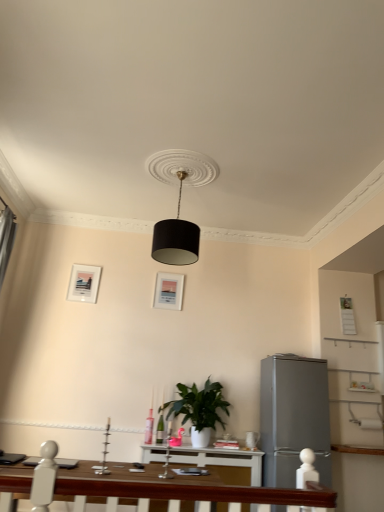
Question: Is black matte lampshade at center smaller than matte white picture frame at upper left, arranged as the first picture frame when viewed from the left?

Choices:
 (A) yes
 (B) no

Answer: (B)

Question: Does black matte lampshade at center have a lesser width compared to matte white picture frame at upper left, arranged as the first picture frame when viewed from the left?

Choices:
 (A) no
 (B) yes

Answer: (A)

Question: Is black matte lampshade at center at the right side of matte white picture frame at upper left, arranged as the first picture frame when viewed from the left?

Choices:
 (A) no
 (B) yes

Answer: (B)

Question: Considering the relative sizes of black matte lampshade at center and matte white picture frame at upper left, arranged as the 2th picture frame when viewed from the right, in the image provided, is black matte lampshade at center taller than matte white picture frame at upper left, arranged as the 2th picture frame when viewed from the right,?

Choices:
 (A) no
 (B) yes

Answer: (B)

Question: Is black matte lampshade at center placed right next to matte white picture frame at upper left, arranged as the first picture frame when viewed from the left?

Choices:
 (A) yes
 (B) no

Answer: (B)

Question: Could matte white picture frame at upper left, arranged as the first picture frame when viewed from the left, be considered to be inside black matte lampshade at center?

Choices:
 (A) yes
 (B) no

Answer: (B)

Question: Is satin silver refrigerator at right far away from black matte lampshade at center?

Choices:
 (A) no
 (B) yes

Answer: (B)

Question: Could you tell me if satin silver refrigerator at right is turned towards black matte lampshade at center?

Choices:
 (A) yes
 (B) no

Answer: (B)

Question: From a real-world perspective, is satin silver refrigerator at right physically above black matte lampshade at center?

Choices:
 (A) no
 (B) yes

Answer: (A)

Question: Does satin silver refrigerator at right lie behind black matte lampshade at center?

Choices:
 (A) no
 (B) yes

Answer: (B)

Question: Is satin silver refrigerator at right next to black matte lampshade at center?

Choices:
 (A) yes
 (B) no

Answer: (B)

Question: Could black matte lampshade at center be considered to be inside satin silver refrigerator at right?

Choices:
 (A) no
 (B) yes

Answer: (A)

Question: Is satin silver refrigerator at right located outside green matte plant at center?

Choices:
 (A) yes
 (B) no

Answer: (A)